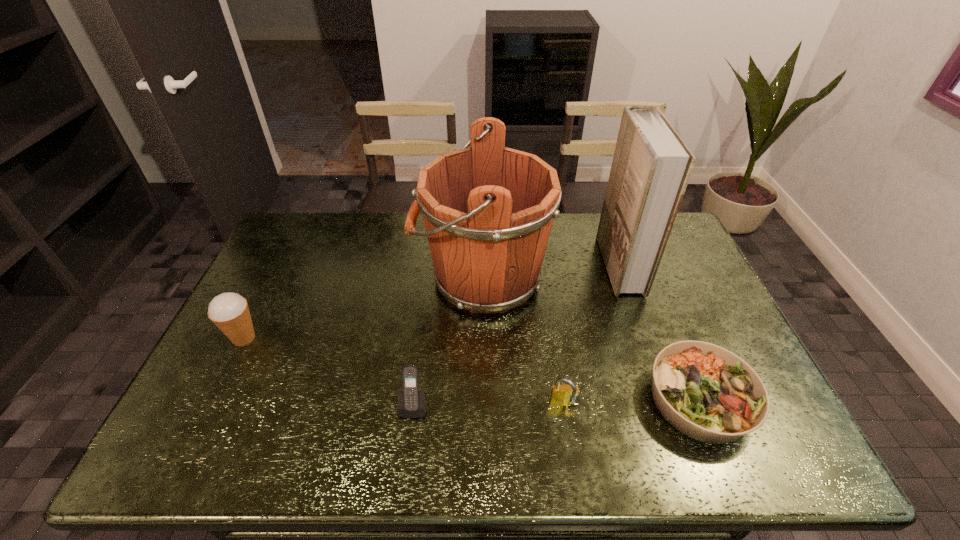
Locate an element on the screen. The width and height of the screenshot is (960, 540). vacant region between the third tallest object and the cellular telephone is located at coordinates (329, 372).

Locate an element on the screen. free space between the cellular telephone and the fourth shortest object is located at coordinates (329, 372).

This screenshot has width=960, height=540. Identify the location of free spot between the shortest object and the fourth shortest object. (472, 369).

Find the location of a particular element. vacant area that lies between the cellular telephone and the bucket is located at coordinates (447, 342).

This screenshot has height=540, width=960. What are the coordinates of `free point between the second shortest object and the bucket` in the screenshot? It's located at (522, 341).

Locate an element on the screen. Image resolution: width=960 pixels, height=540 pixels. free space between the bucket and the third tallest object is located at coordinates (363, 308).

The width and height of the screenshot is (960, 540). In order to click on free space that is in between the shortest object and the bucket in this screenshot , I will do coord(590,339).

Where is `object that is the fourth closest one to the third tallest object`? object that is the fourth closest one to the third tallest object is located at coordinates (706, 392).

Find the location of a particular element. This screenshot has width=960, height=540. object that is the fourth closest to the phonebook is located at coordinates (411, 402).

This screenshot has width=960, height=540. I want to click on vacant region that satisfies the following two spatial constraints: 1. on the cover of the phonebook; 2. on the side with the combination dials of the padlock, so click(668, 404).